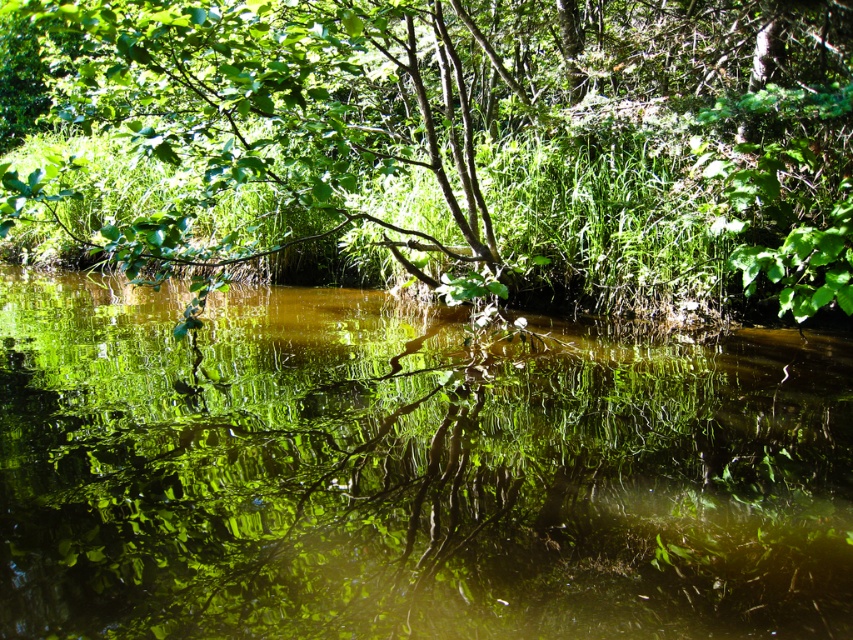
Can you confirm if green reflective water at center is bigger than green leafy tree at center?

No, green reflective water at center is not bigger than green leafy tree at center.

How much distance is there between green reflective water at center and green leafy tree at center?

green reflective water at center and green leafy tree at center are 2.84 meters apart.

This screenshot has height=640, width=853. Describe the element at coordinates (408, 476) in the screenshot. I see `green reflective water at center` at that location.

What are the coordinates of `green reflective water at center` in the screenshot? It's located at (408, 476).